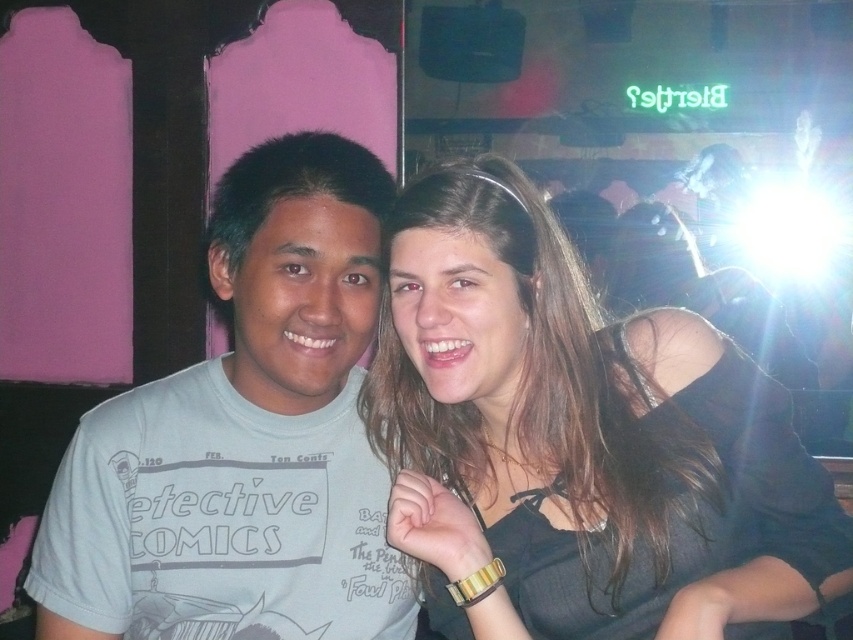
Question: Which of the following is the closest to the observer?

Choices:
 (A) (577, 433)
 (B) (363, 346)

Answer: (A)

Question: Is dark brown hair at center closer to camera compared to light gray cotton t-shirt at center?

Choices:
 (A) no
 (B) yes

Answer: (B)

Question: Is dark brown hair at center below light gray cotton t-shirt at center?

Choices:
 (A) no
 (B) yes

Answer: (B)

Question: Among these objects, which one is farthest from the camera?

Choices:
 (A) light gray cotton t-shirt at center
 (B) dark brown hair at center

Answer: (A)

Question: Among these points, which one is nearest to the camera?

Choices:
 (A) (427, 330)
 (B) (381, 557)

Answer: (A)

Question: Does dark brown hair at center appear on the right side of light gray cotton t-shirt at center?

Choices:
 (A) yes
 (B) no

Answer: (A)